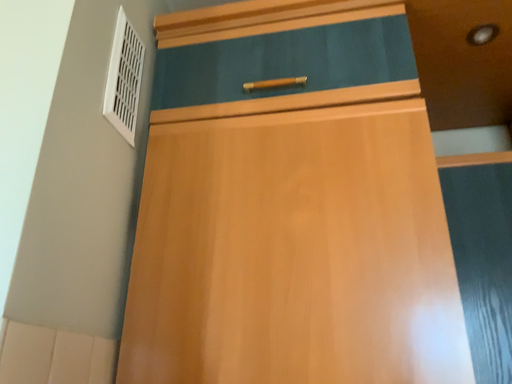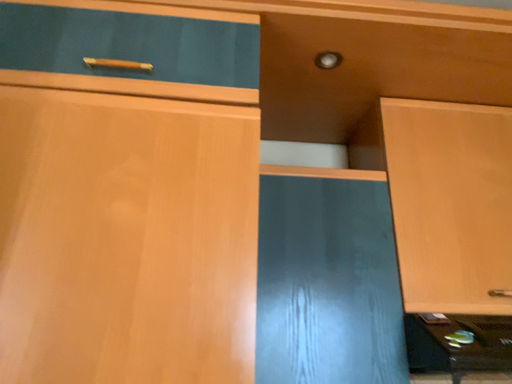
Question: Which way did the camera rotate in the video?

Choices:
 (A) rotated right
 (B) rotated left

Answer: (A)